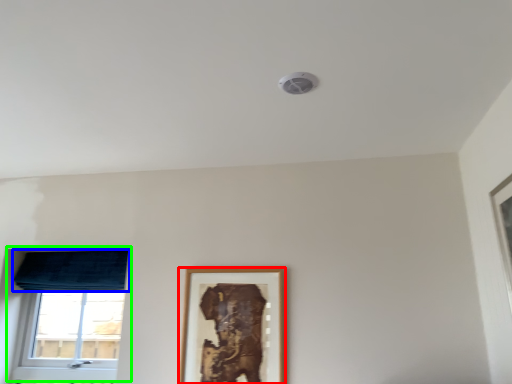
Question: Considering the real-world distances, which object is closest to picture frame (highlighted by a red box)? curtain (highlighted by a blue box) or window (highlighted by a green box).

Choices:
 (A) curtain
 (B) window

Answer: (A)